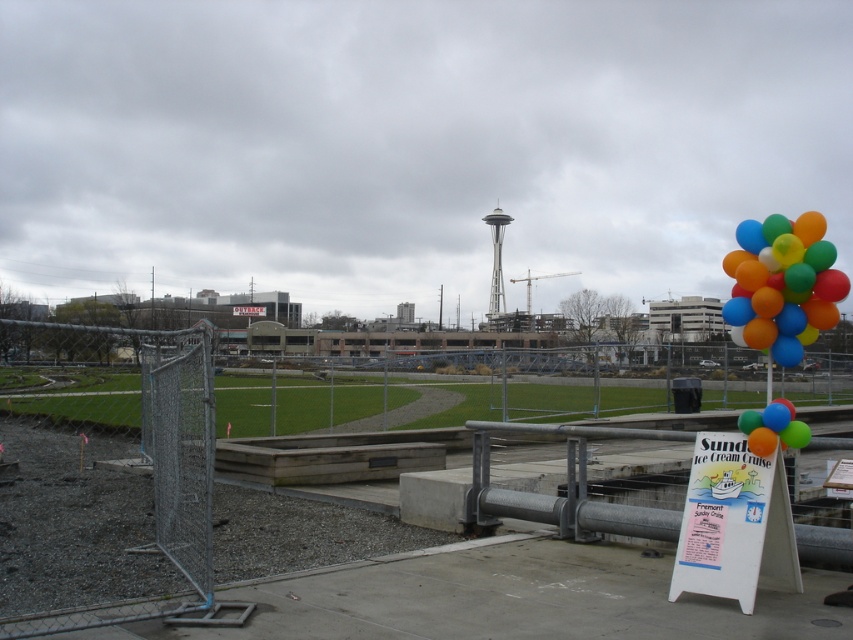
You are a photographer setting up equipment in the foreground of the scene. You need to place a tripod between the white cardboard sign at lower right and the multicolored glossy balloons at right. Considering their sizes, which object should you position the tripod closer to to ensure it doesn

The white cardboard sign at lower right has a smaller size compared to the multicolored glossy balloons at right. To ensure the tripod is appropriately sized for the space, you should position it closer to the white cardboard sign at lower right since it requires less space.